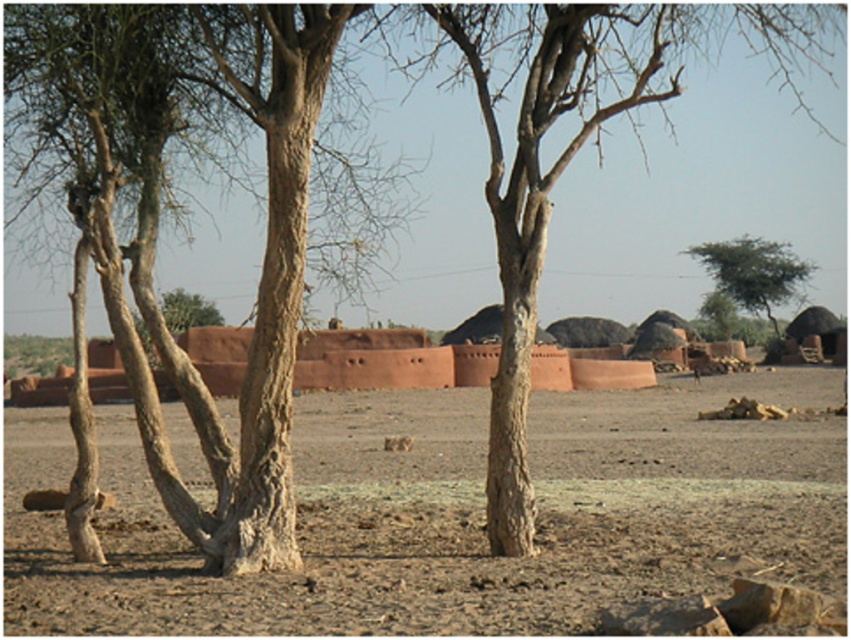
Question: Does smooth bark tree at center appear over green leafy tree at upper right?

Choices:
 (A) yes
 (B) no

Answer: (A)

Question: Which of the following is the farthest from the observer?

Choices:
 (A) green leafy tree at upper right
 (B) brown rough tree trunk at center
 (C) smooth bark tree at center
 (D) brown sandy dirt at center

Answer: (A)

Question: Which point is closer to the camera?

Choices:
 (A) (261, 608)
 (B) (586, 104)
 (C) (797, 260)

Answer: (A)

Question: Which object is closer to the camera taking this photo?

Choices:
 (A) brown rough tree trunk at center
 (B) brown sandy dirt at center
 (C) green leafy tree at upper right
 (D) smooth bark tree at center

Answer: (B)

Question: Does smooth bark tree at center appear on the right side of green leafy tree at upper right?

Choices:
 (A) yes
 (B) no

Answer: (B)

Question: Is green leafy tree at upper right further to the viewer compared to brown rough tree trunk at center?

Choices:
 (A) yes
 (B) no

Answer: (A)